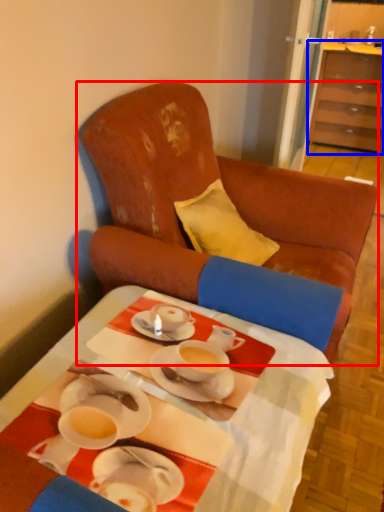
Question: Which object appears closest to the camera in this image, chair (highlighted by a red box) or cabinetry (highlighted by a blue box)?

Choices:
 (A) chair
 (B) cabinetry

Answer: (A)